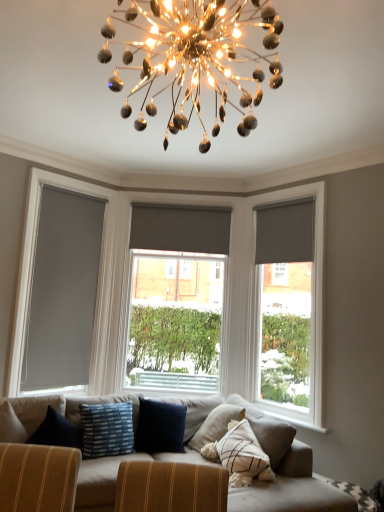
Question: Is textured beige couch at center to the left or to the right of blue striped fabric pillow at center in the image?

Choices:
 (A) right
 (B) left

Answer: (A)

Question: Based on their sizes in the image, would you say textured beige couch at center is bigger or smaller than blue striped fabric pillow at center?

Choices:
 (A) big
 (B) small

Answer: (A)

Question: Considering the real-world distances, which object is farthest from the matte gray roller blind at center, placed as the 2th window when sorted from right to left?

Choices:
 (A) matte gray roller blind at right, arranged as the 2th curtain when viewed from the left
 (B) matte gray roller blind at left
 (C) matte gray curtain at center, placed as the first curtain when sorted from back to front
 (D) shiny metallic chandelier at upper center
 (E) matte gray roller blind at right, marked as the second window in a left-to-right arrangement

Answer: (D)

Question: Which object is the closest to the shiny metallic chandelier at upper center?

Choices:
 (A) matte gray curtain at center, placed as the first curtain when sorted from back to front
 (B) matte gray roller blind at right, placed as the 2th curtain when sorted from back to front
 (C) blue striped fabric pillow at center
 (D) matte gray roller blind at center, which is the 1th window from left to right
 (E) textured beige couch at center

Answer: (B)